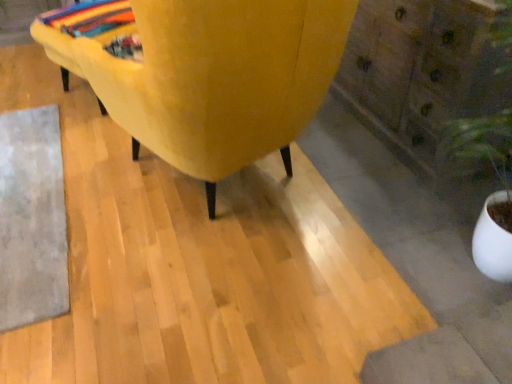
Question: From the image's perspective, is wooden dresser at lower right positioned above or below velvet yellow chair at center?

Choices:
 (A) below
 (B) above

Answer: (B)

Question: Is wooden dresser at lower right taller or shorter than velvet yellow chair at center?

Choices:
 (A) short
 (B) tall

Answer: (A)

Question: Which object is positioned farthest from the gray woolen mat at lower left?

Choices:
 (A) multicolored woven blanket at upper left
 (B) velvet yellow chair at center
 (C) wooden dresser at lower right

Answer: (C)

Question: Estimate the real-world distances between objects in this image. Which object is farther from the multicolored woven blanket at upper left?

Choices:
 (A) velvet yellow chair at center
 (B) gray woolen mat at lower left
 (C) wooden dresser at lower right

Answer: (C)